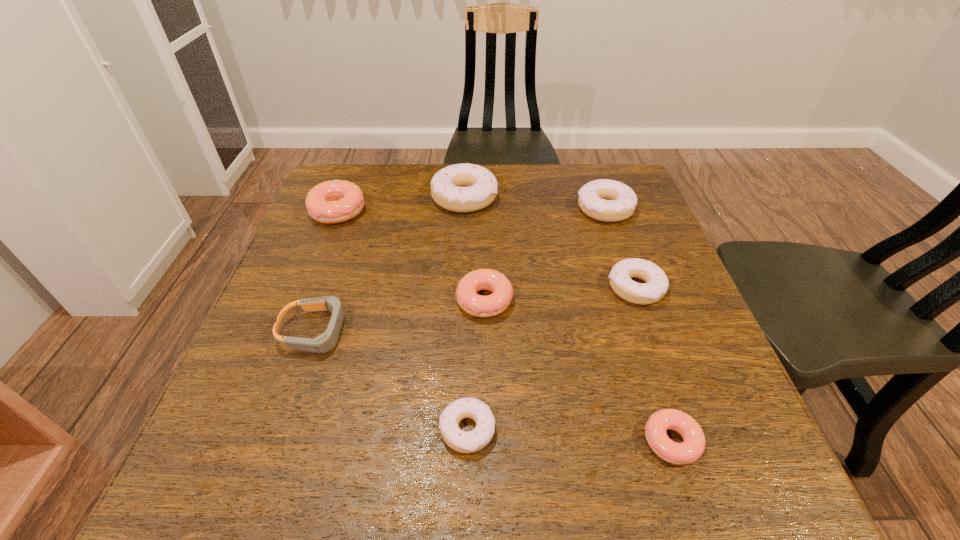
The height and width of the screenshot is (540, 960). Find the location of `the nearest white doughnut`. the nearest white doughnut is located at coordinates (465, 442).

This screenshot has height=540, width=960. Identify the location of free location located 0.270m on the left of the biggest white doughnut. 333,197.

This screenshot has height=540, width=960. In order to click on free spot located 0.200m on the right of the leftmost doughnut in this screenshot , I will do `click(442, 211)`.

Locate an element on the screen. Image resolution: width=960 pixels, height=540 pixels. vacant space located on the front of the second biggest white doughnut is located at coordinates (622, 258).

In order to click on free spot located on the left of the second biggest pink doughnut in this screenshot , I will do `click(323, 301)`.

At what (x,y) coordinates should I click in order to perform the action: click on vacant region located 0.300m on the left of the second nearest white doughnut. Please return your answer as a coordinate pair (x, y). The height and width of the screenshot is (540, 960). Looking at the image, I should click on (469, 288).

At what (x,y) coordinates should I click in order to perform the action: click on blank space located on the front and back of the goggles. Please return your answer as a coordinate pair (x, y). Looking at the image, I should click on (492, 331).

Find the location of `vacant region located 0.060m on the back of the smallest pink doughnut`. vacant region located 0.060m on the back of the smallest pink doughnut is located at coordinates (653, 385).

Locate an element on the screen. vacant point located 0.310m on the right of the smallest white doughnut is located at coordinates (684, 430).

At what (x,y) coordinates should I click in order to perform the action: click on doughnut that is at the left edge. Please return your answer as a coordinate pair (x, y). Looking at the image, I should click on (335, 201).